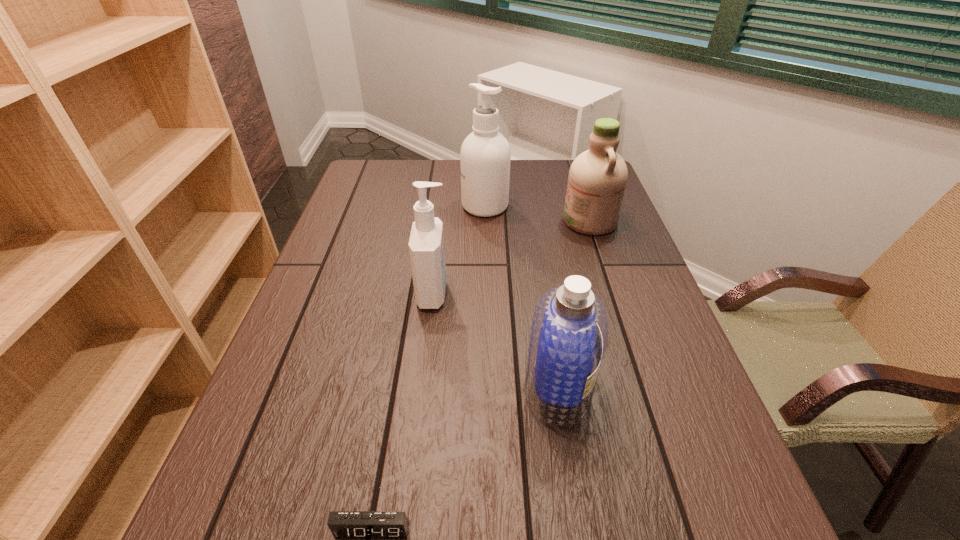
Image resolution: width=960 pixels, height=540 pixels. I want to click on vacant space located on the front label of the rightmost object, so click(466, 221).

Where is `vacant space situated on the front label of the rightmost object`? Image resolution: width=960 pixels, height=540 pixels. vacant space situated on the front label of the rightmost object is located at coordinates (539, 221).

Identify the location of vacant region located 0.320m on the front label of the rightmost object. (452, 221).

Find the location of a particular element. free point located 0.280m on the front label of the third farthest object is located at coordinates (567, 293).

Locate an element on the screen. This screenshot has height=540, width=960. vacant space situated on the left of the nearest cleansing agent is located at coordinates (335, 388).

You are a GUI agent. You are given a task and a screenshot of the screen. Output one action in this format:
    pyautogui.click(x=<x>, y=<y>)
    Task: Click on the object at the far edge
    The height and width of the screenshot is (540, 960).
    Given the screenshot: What is the action you would take?
    pyautogui.click(x=485, y=155)

Locate an element on the screen. The image size is (960, 540). object located in the near edge section of the desktop is located at coordinates (343, 524).

Find the location of a particular element. The width and height of the screenshot is (960, 540). object at the right edge is located at coordinates (597, 179).

At what (x,y) coordinates should I click in order to perform the action: click on free space at the far edge of the desktop. Please return your answer as a coordinate pair (x, y). This screenshot has width=960, height=540. Looking at the image, I should click on [x=431, y=187].

In the image, there is a desktop. Identify the location of free space at the left edge. Image resolution: width=960 pixels, height=540 pixels. (256, 400).